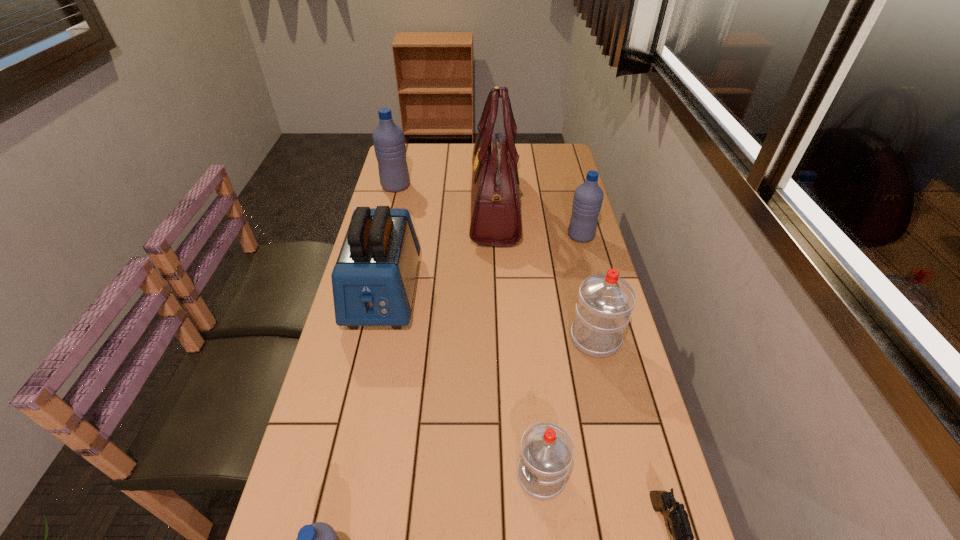
Where is `free region located 0.190m on the handle side of the left white water bottle`? Image resolution: width=960 pixels, height=540 pixels. free region located 0.190m on the handle side of the left white water bottle is located at coordinates (424, 475).

Find the location of `vacant area situated 0.400m on the handle side of the left white water bottle`. vacant area situated 0.400m on the handle side of the left white water bottle is located at coordinates (323, 475).

Locate an element on the screen. This screenshot has width=960, height=540. free location located on the handle side of the left white water bottle is located at coordinates (453, 475).

I want to click on water bottle positioned at the left edge, so click(x=388, y=139).

The width and height of the screenshot is (960, 540). Identify the location of toaster that is at the left edge. (373, 280).

Locate an element on the screen. This screenshot has width=960, height=540. free space at the far edge is located at coordinates (526, 150).

In the image, there is a desktop. At what (x,y) coordinates should I click in order to perform the action: click on vacant space at the left edge. Please return your answer as a coordinate pair (x, y). Image resolution: width=960 pixels, height=540 pixels. Looking at the image, I should click on (343, 419).

Locate an element on the screen. Image resolution: width=960 pixels, height=540 pixels. free space at the right edge of the desktop is located at coordinates (616, 453).

Find the location of a particular element. This screenshot has width=960, height=540. free space that is in between the second farthest blue water bottle and the smaller white water bottle is located at coordinates (561, 356).

Find the location of a particular element. free space that is in between the left white water bottle and the second nearest blue water bottle is located at coordinates (561, 356).